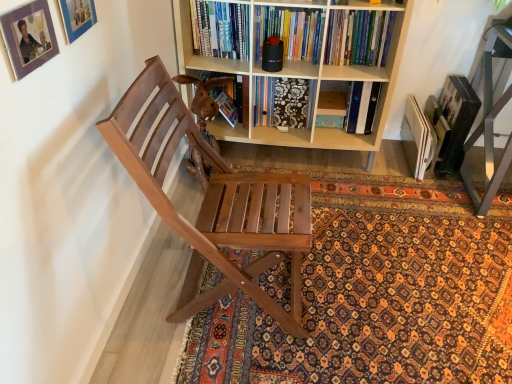
Question: From their relative heights in the image, would you say light wood bookcase at center is taller or shorter than matte blue picture frame at upper left, the 2th picture frame when ordered from front to back?

Choices:
 (A) tall
 (B) short

Answer: (A)

Question: Would you say light wood bookcase at center is to the left or to the right of matte blue picture frame at upper left, the 2th picture frame when ordered from front to back, in the picture?

Choices:
 (A) right
 (B) left

Answer: (A)

Question: Which is farther from the matte blue picture frame at upper left, the first picture frame when ordered from back to front?

Choices:
 (A) hardcover book at upper center
 (B) light wood bookcase at center
 (C) patterned carpet at center
 (D) matte purple picture frame at upper left, marked as the first picture frame in a front-to-back arrangement
 (E) wooden chair at left

Answer: (C)

Question: Based on their relative distances, which object is farther from the patterned carpet at center?

Choices:
 (A) matte purple picture frame at upper left, which is the second picture frame from back to front
 (B) hardcover book at upper center
 (C) brown wooden swivel chair at center
 (D) matte blue picture frame at upper left, the first picture frame when ordered from back to front
 (E) wooden chair at left

Answer: (D)